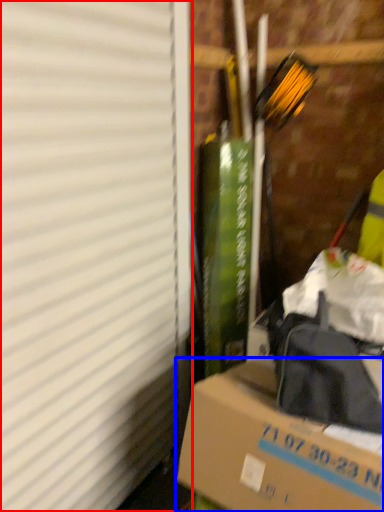
Question: Among these objects, which one is farthest to the camera, window screen (highlighted by a red box) or box (highlighted by a blue box)?

Choices:
 (A) window screen
 (B) box

Answer: (B)